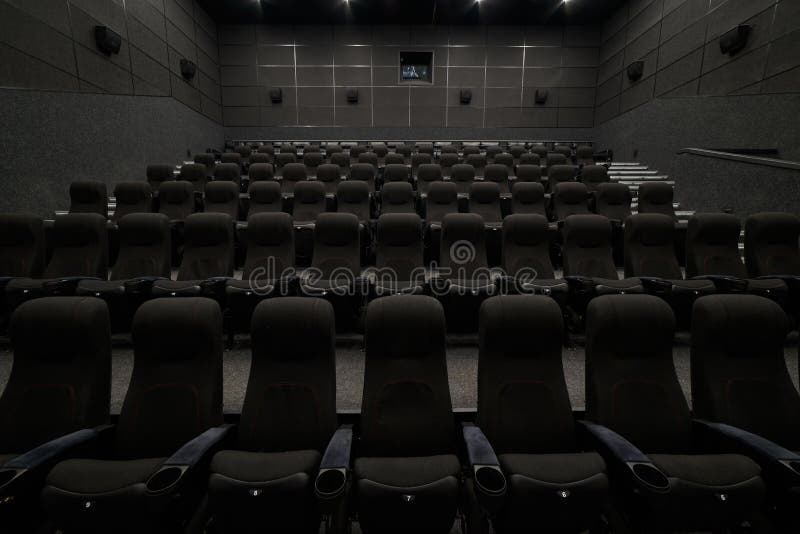
This screenshot has width=800, height=534. I want to click on speakers, so click(x=112, y=46), click(x=192, y=67), click(x=274, y=97), click(x=352, y=97), click(x=465, y=95), click(x=540, y=91), click(x=633, y=70), click(x=734, y=43).